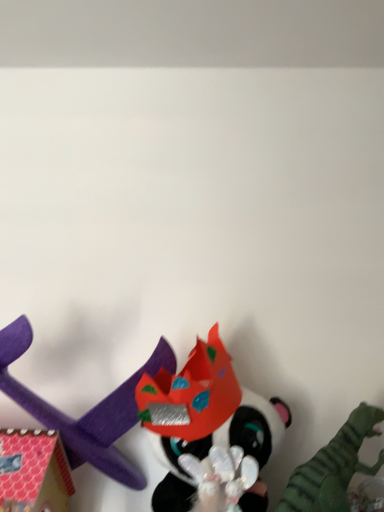
Question: Could shiny plastic mask at center, the 3th toy viewed from the left, be considered to be inside shiny red paper crown at center, which ranks as the 2th toy in left-to-right order?

Choices:
 (A) yes
 (B) no

Answer: (B)

Question: Can you confirm if shiny red paper crown at center, which ranks as the 2th toy in left-to-right order, is wider than shiny plastic mask at center, the 3th toy viewed from the left?

Choices:
 (A) yes
 (B) no

Answer: (B)

Question: Is shiny red paper crown at center, acting as the 2th toy starting from the right, looking in the opposite direction of shiny plastic mask at center, the first toy in the right-to-left sequence?

Choices:
 (A) yes
 (B) no

Answer: (A)

Question: From the image's perspective, does shiny red paper crown at center, acting as the 2th toy starting from the right, appear lower than shiny plastic mask at center, the 3th toy viewed from the left?

Choices:
 (A) yes
 (B) no

Answer: (B)

Question: Is shiny red paper crown at center, which ranks as the 2th toy in left-to-right order, far away from shiny plastic mask at center, the first toy in the right-to-left sequence?

Choices:
 (A) yes
 (B) no

Answer: (B)

Question: From the image's perspective, is shiny red paper crown at center, which ranks as the 2th toy in left-to-right order, located above shiny plastic mask at center, the first toy in the right-to-left sequence?

Choices:
 (A) no
 (B) yes

Answer: (B)

Question: Does purple foam airplane at lower left, which appears as the 1th toy when viewed from the left, have a lesser width compared to shiny plastic mask at center, the 3th toy viewed from the left?

Choices:
 (A) no
 (B) yes

Answer: (B)

Question: Is purple foam airplane at lower left, the third toy positioned from the right, positioned in front of shiny plastic mask at center, the first toy in the right-to-left sequence?

Choices:
 (A) yes
 (B) no

Answer: (B)

Question: Considering the relative sizes of purple foam airplane at lower left, which appears as the 1th toy when viewed from the left, and shiny plastic mask at center, the 3th toy viewed from the left, in the image provided, is purple foam airplane at lower left, which appears as the 1th toy when viewed from the left, wider than shiny plastic mask at center, the 3th toy viewed from the left,?

Choices:
 (A) yes
 (B) no

Answer: (B)

Question: Considering the relative sizes of purple foam airplane at lower left, which appears as the 1th toy when viewed from the left, and shiny plastic mask at center, the first toy in the right-to-left sequence, in the image provided, is purple foam airplane at lower left, which appears as the 1th toy when viewed from the left, shorter than shiny plastic mask at center, the first toy in the right-to-left sequence,?

Choices:
 (A) no
 (B) yes

Answer: (A)

Question: Is purple foam airplane at lower left, which appears as the 1th toy when viewed from the left, outside shiny plastic mask at center, the 3th toy viewed from the left?

Choices:
 (A) no
 (B) yes

Answer: (B)

Question: Is the position of purple foam airplane at lower left, the third toy positioned from the right, more distant than that of shiny plastic mask at center, the first toy in the right-to-left sequence?

Choices:
 (A) yes
 (B) no

Answer: (A)

Question: Are shiny red paper crown at center, acting as the 2th toy starting from the right, and purple foam airplane at lower left, which appears as the 1th toy when viewed from the left, far apart?

Choices:
 (A) no
 (B) yes

Answer: (A)